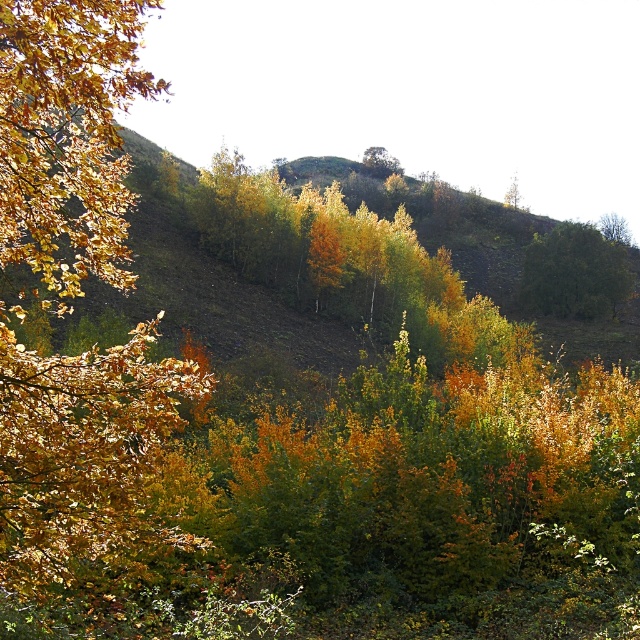
You are standing at the point marked by point (573, 273) in the image. Looking around, you see a green leafy tree at center. What is the color of the tree you are facing?

The point (573, 273) marks the green leafy tree at center, so the tree you are facing is green.

You are standing in the autumnal landscape and want to pick a leaf from the golden leafy branch at left. Based on its position, can you estimate how far to your left you need to reach?

The golden leafy branch at left is located at point (x=83, y=460), which means it is positioned to the far left and slightly lower in the scene. You would need to reach far to your left to access it.